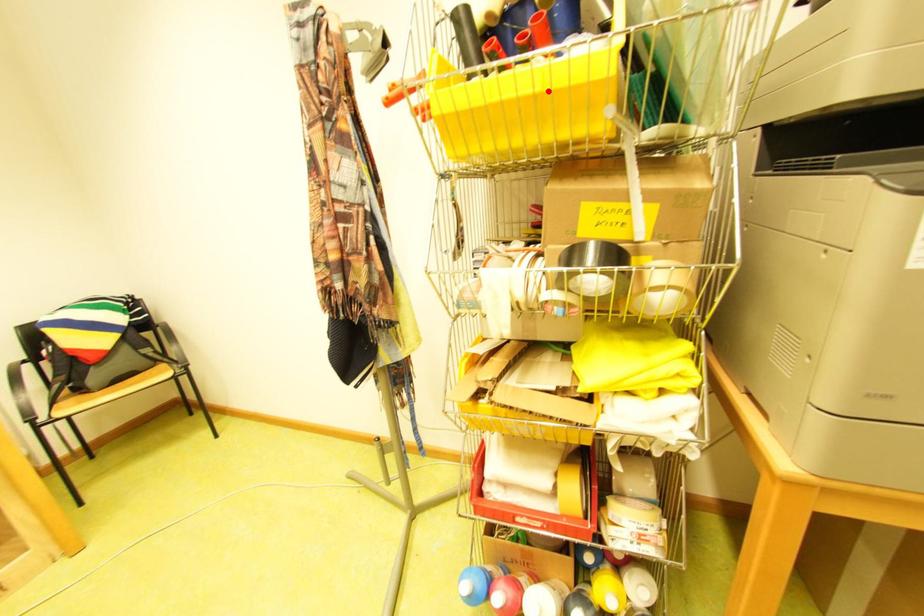
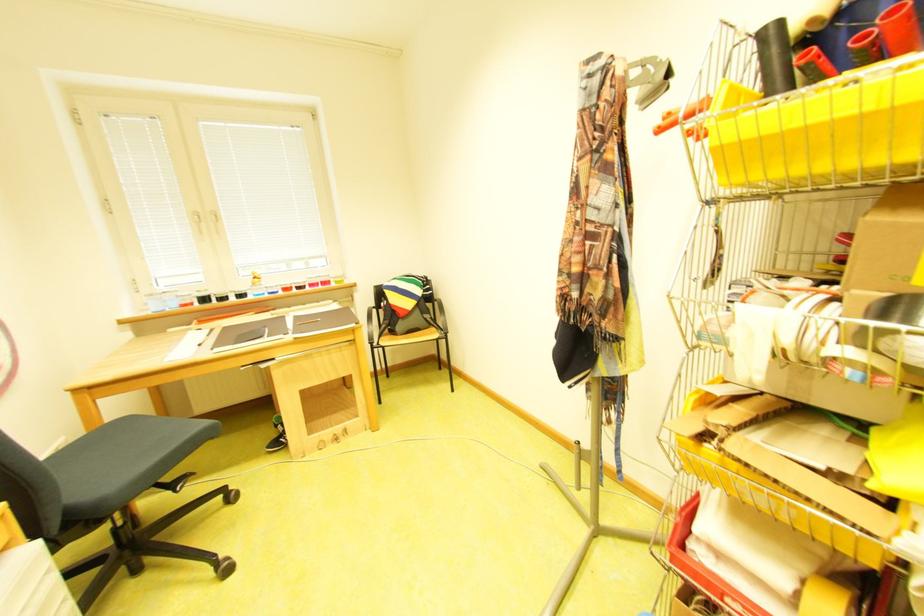
Locate, in the second image, the point that corresponds to the highlighted location in the first image.

(882, 108)